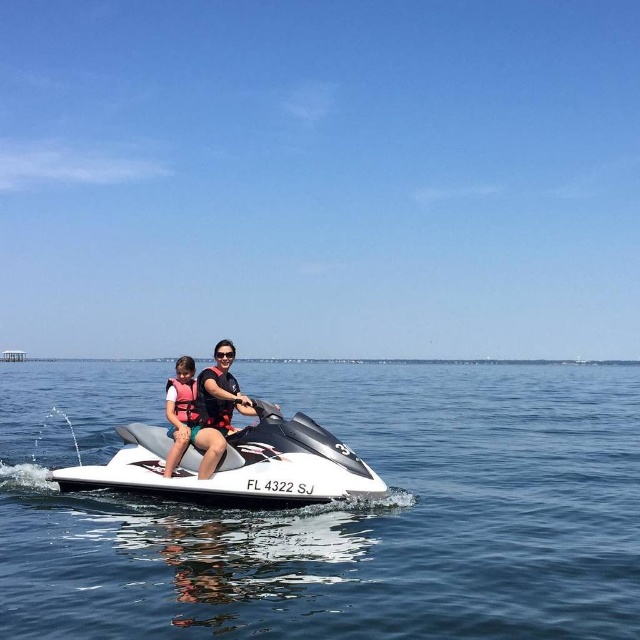
Question: Is white glossy jet ski at center below matte black jet ski at center?

Choices:
 (A) no
 (B) yes

Answer: (B)

Question: Which is nearer to the clear blue water at center?

Choices:
 (A) matte black jet ski at center
 (B) white glossy jet ski at center
 (C) white life vest at center

Answer: (A)

Question: Which of the following is the farthest from the observer?

Choices:
 (A) white glossy jet ski at center
 (B) clear blue water at center
 (C) white life vest at center

Answer: (C)

Question: Is clear blue water at center further to camera compared to matte black jet ski at center?

Choices:
 (A) yes
 (B) no

Answer: (B)

Question: Which point is closer to the camera?

Choices:
 (A) (168, 397)
 (B) (621, 410)

Answer: (A)

Question: Can you confirm if clear blue water at center is positioned above white glossy jet ski at center?

Choices:
 (A) no
 (B) yes

Answer: (A)